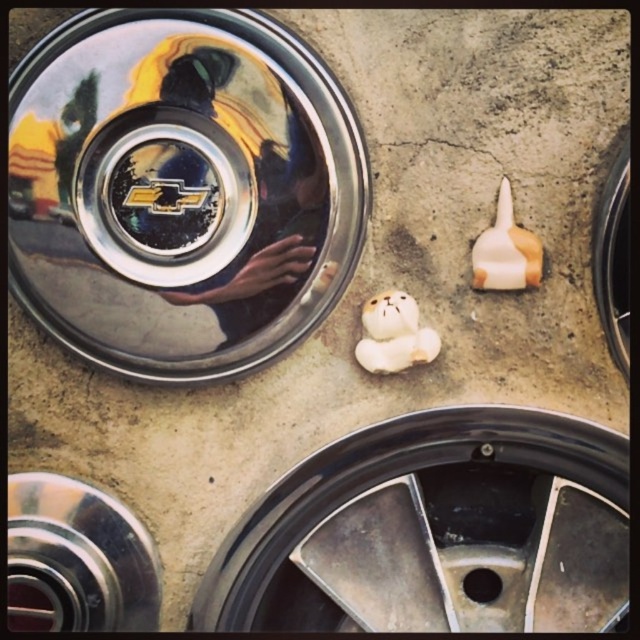
Can you confirm if chrome metallic hubcap at upper left is wider than tan matte bear at center?

Indeed, chrome metallic hubcap at upper left has a greater width compared to tan matte bear at center.

Does chrome metallic hubcap at upper left have a lesser height compared to tan matte bear at center?

No, chrome metallic hubcap at upper left is not shorter than tan matte bear at center.

Does point (44, 298) lie in front of point (532, 252)?

No, it is behind (532, 252).

Locate an element on the screen. The image size is (640, 640). chrome metallic hubcap at upper left is located at coordinates (180, 189).

Does chrome metallic hubcap at upper left have a lesser height compared to black rubber tire at right?

In fact, chrome metallic hubcap at upper left may be taller than black rubber tire at right.

Who is taller, chrome metallic hubcap at upper left or black rubber tire at right?

chrome metallic hubcap at upper left

Which is in front, point (324, 246) or point (620, 352)?

Point (324, 246) is in front.

The image size is (640, 640). Identify the location of chrome metallic hubcap at upper left. click(180, 189).

Looking at this image, does chrome metallic hubcap at upper left appear under white glossy bear at center?

Actually, chrome metallic hubcap at upper left is above white glossy bear at center.

Find the location of `chrome metallic hubcap at upper left`. chrome metallic hubcap at upper left is located at coordinates (180, 189).